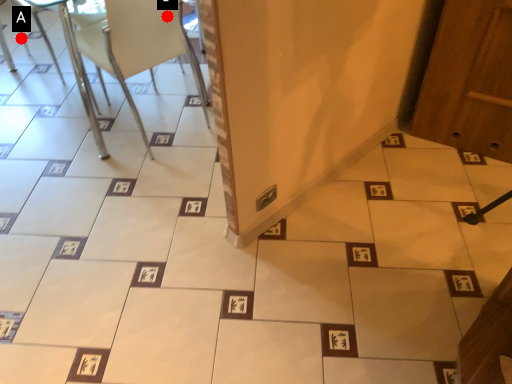
Question: Two points are circled on the image, labeled by A and B beside each circle. Which point is closer to the camera taking this photo?

Choices:
 (A) A is closer
 (B) B is closer

Answer: (B)